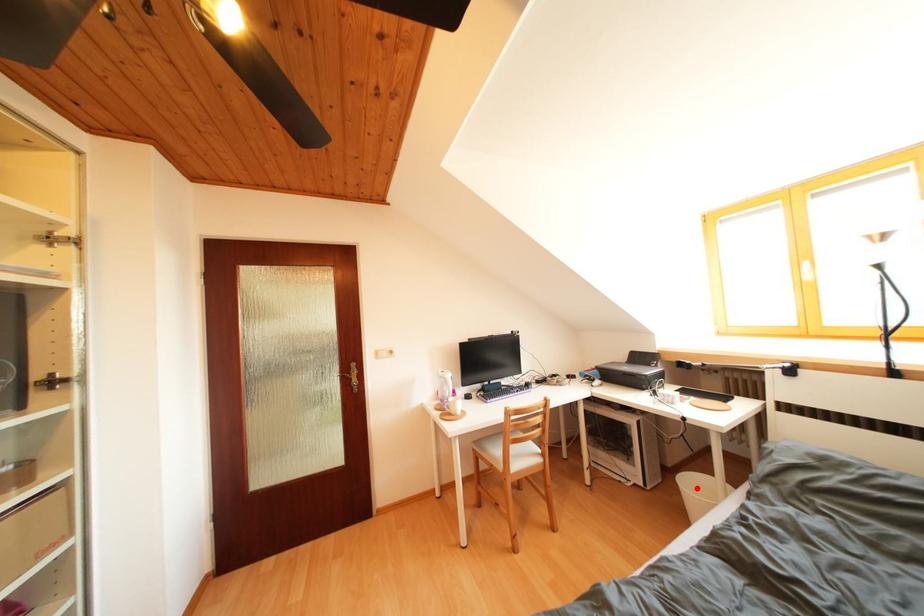
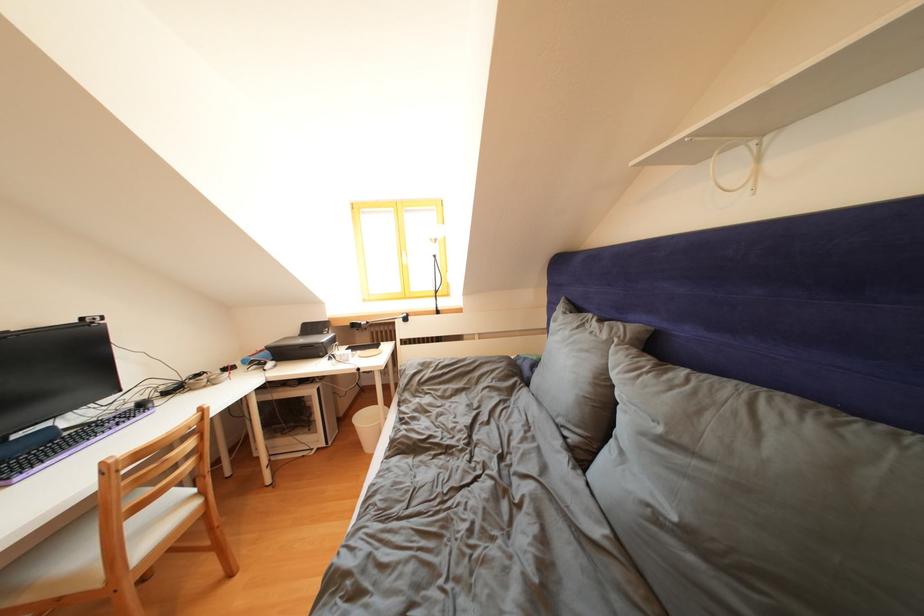
Question: I am providing you with two images of the same scene from different viewpoints. Given a red point in image1, look at the same physical point in image2. Is it:

Choices:
 (A) Closer to the viewpoint
 (B) Farther from the viewpoint

Answer: (B)